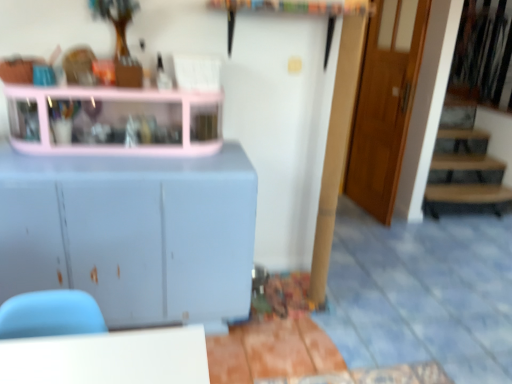
Identify the location of vacant space in front of wooden door at right. (368, 231).